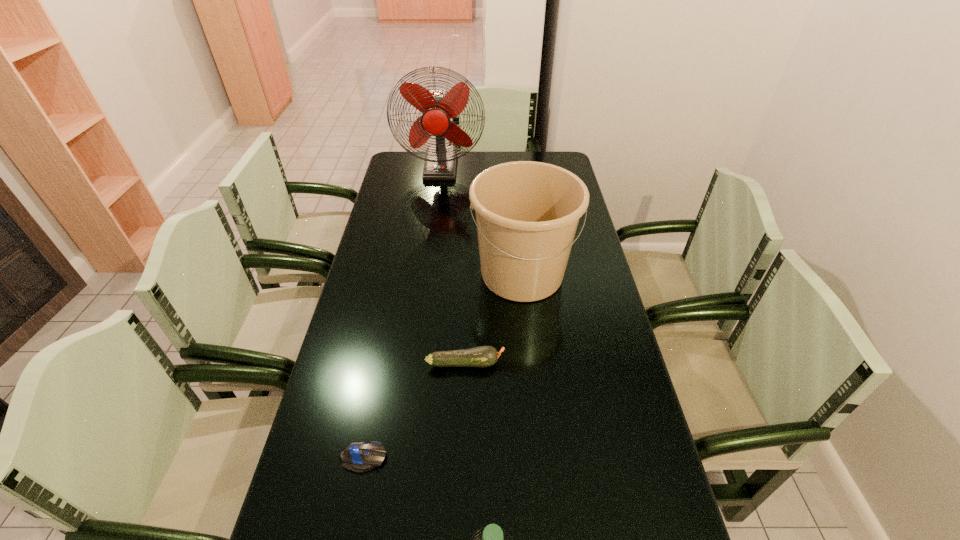
Where is `the tallest object`? This screenshot has width=960, height=540. the tallest object is located at coordinates (437, 106).

Identify the location of the farthest object. (437, 106).

This screenshot has width=960, height=540. What are the coordinates of `bucket` in the screenshot? It's located at 527,213.

Find the location of `the second tallest object`. the second tallest object is located at coordinates [527, 213].

The image size is (960, 540). I want to click on the third farthest object, so click(x=483, y=356).

This screenshot has width=960, height=540. What are the coordinates of `zucchini` in the screenshot? It's located at (483, 356).

Identify the location of the fourth farthest object. (359, 457).

I want to click on computer mouse, so click(359, 457).

This screenshot has height=540, width=960. In order to click on free location located 0.340m on the front-facing side of the fan in this screenshot , I will do point(432,230).

The height and width of the screenshot is (540, 960). I want to click on vacant space located on the front of the second tallest object, so click(540, 438).